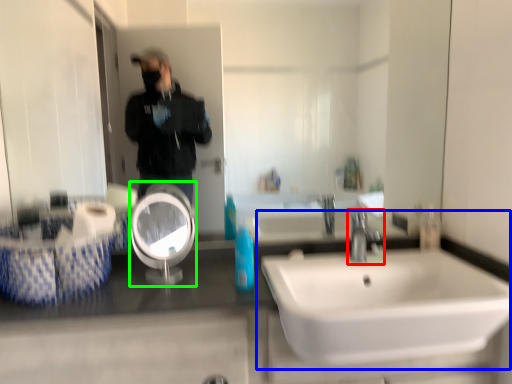
Question: Estimate the real-world distances between objects in this image. Which object is closer to tap (highlighted by a red box), sink (highlighted by a blue box) or reflection (highlighted by a green box)?

Choices:
 (A) sink
 (B) reflection

Answer: (A)